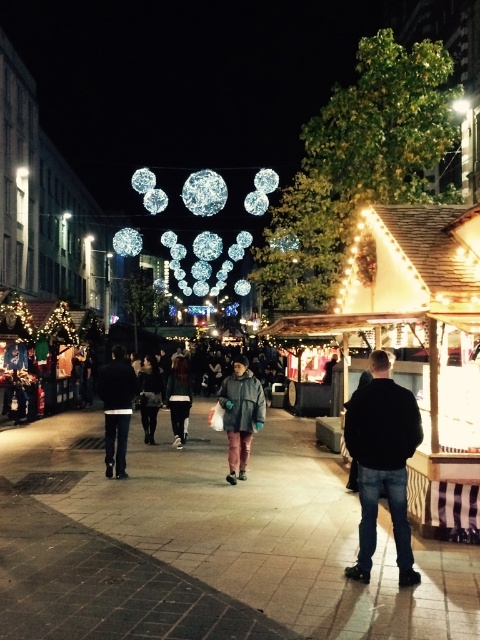
You are a person standing at the edge of the market, looking towards the center. You see two jackets in the crowd. Which jacket is closer to the right side of the image, the black matte jacket at center or the dark gray jacket at center?

The black matte jacket at center is closer to the right side of the image because it is positioned to the right of the dark gray jacket at center.

You are standing at the center of the image and want to walk towards the point labeled as point (x=247, y=406). However, there is an obstacle at point (x=109, y=422). Can you safely walk towards your target without passing through the obstacle?

Yes, you can safely walk towards point (x=247, y=406) because it is in front of point (x=109, y=422), meaning the obstacle is behind your path and won from interfering.